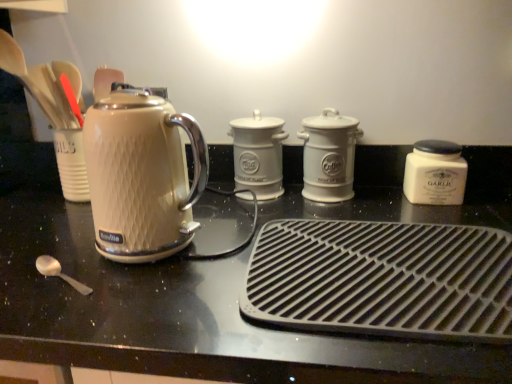
Identify the location of vacant space in between white ceramic coffee canister at center, acting as the 2th kitchen appliance starting from the back, and white ceramic jar at right, which is counted as the third kitchen appliance, starting from the back. [384, 195].